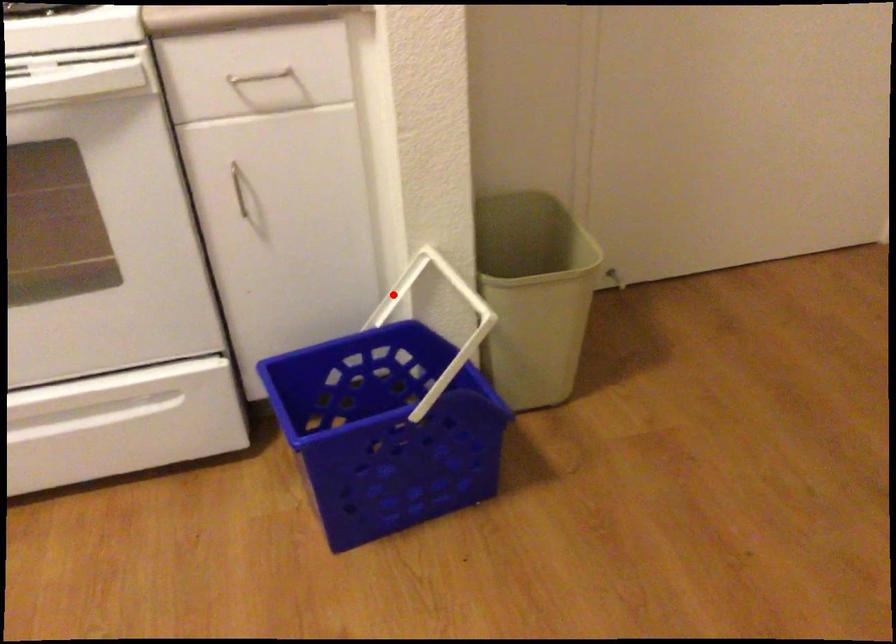
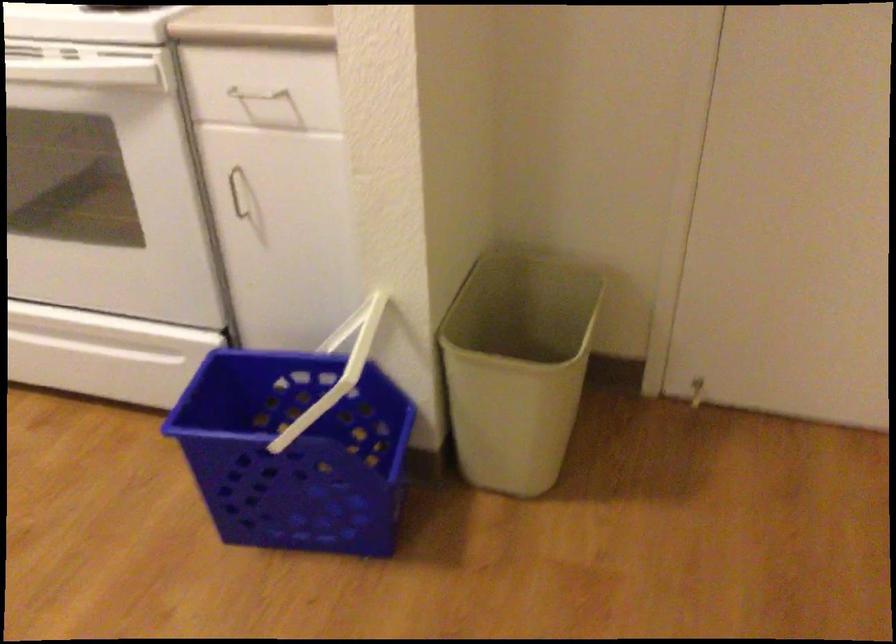
In the second image, find the point that corresponds to the highlighted location in the first image.

(346, 328)